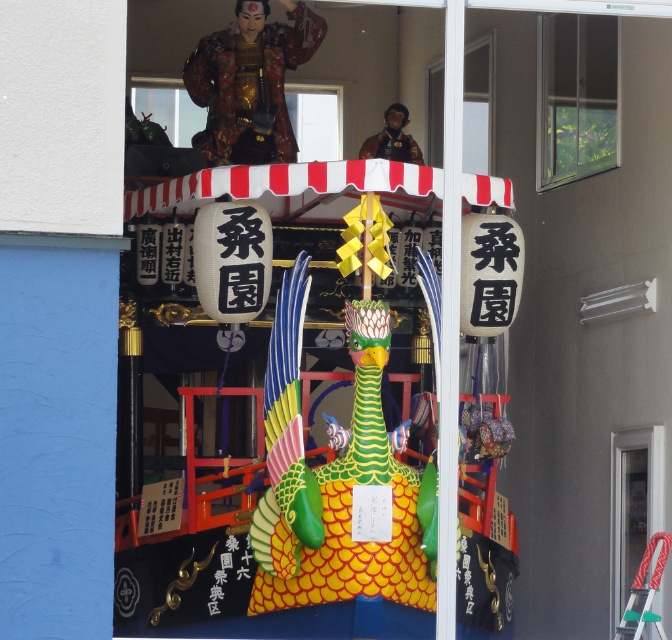
Question: Which object is farther from the camera taking this photo?

Choices:
 (A) transparent glass window at upper center
 (B) shiny green and yellow fish at center

Answer: (B)

Question: Does transparent glass statue at upper center have a lesser width compared to transparent glass door at right?

Choices:
 (A) yes
 (B) no

Answer: (B)

Question: Which object is positioned farthest from the transparent glass window at upper center?

Choices:
 (A) transparent glass statue at upper center
 (B) clear glass window at upper right
 (C) shiny green and yellow fish at center

Answer: (C)

Question: Which of the following is the farthest from the observer?

Choices:
 (A) shiny green and yellow fish at center
 (B) transparent glass window at upper center

Answer: (A)

Question: Does transparent glass door at right have a greater width compared to transparent glass window at upper center?

Choices:
 (A) yes
 (B) no

Answer: (B)

Question: Observing the image, what is the correct spatial positioning of shiny green and yellow fish at center in reference to transparent glass statue at upper center?

Choices:
 (A) left
 (B) right

Answer: (B)